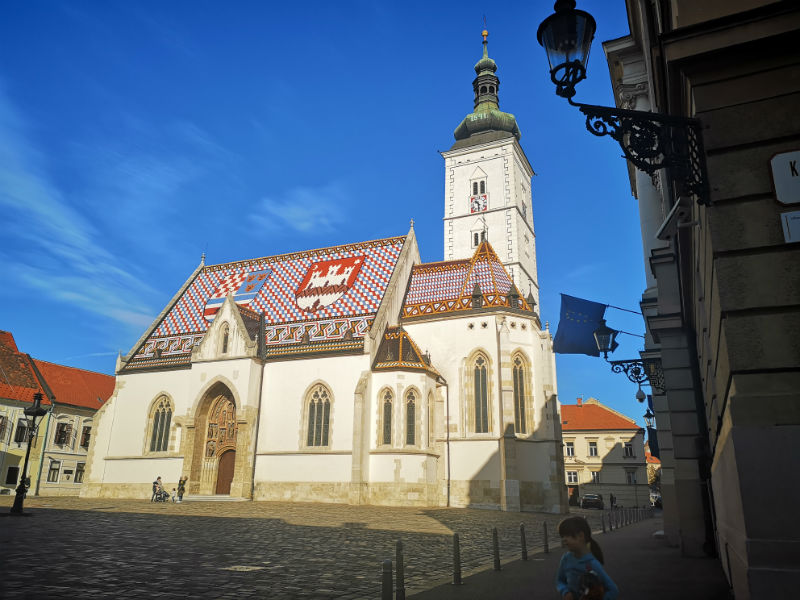
Find the location of a particular element. light is located at coordinates (34, 415).